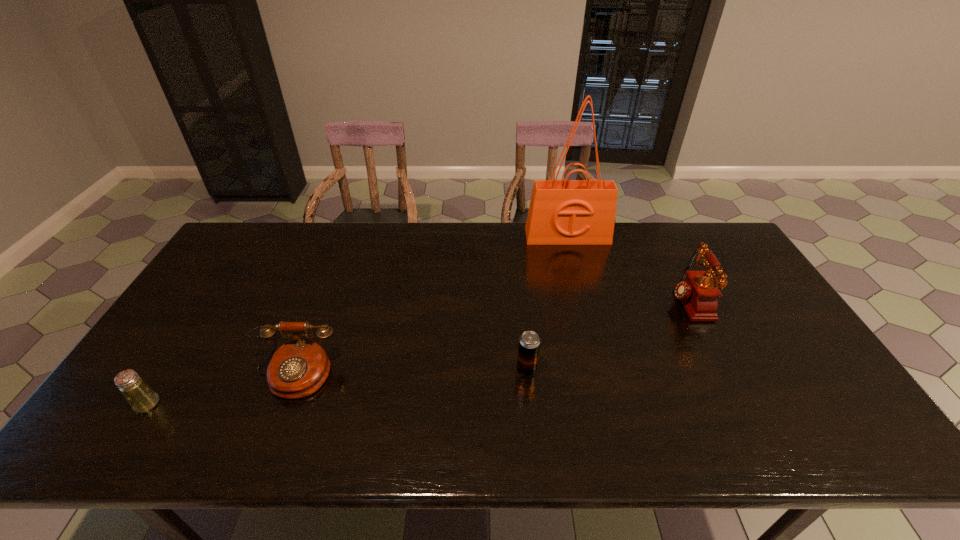
The image size is (960, 540). I want to click on vacant area that lies between the beer can and the shorter telephone, so click(410, 372).

This screenshot has width=960, height=540. I want to click on empty location between the third object from right to left and the tote bag, so click(x=547, y=303).

You are a GUI agent. You are given a task and a screenshot of the screen. Output one action in this format:
    pyautogui.click(x=<x>, y=<y>)
    Task: Click on the empty location between the farthest object and the left telephone
    This screenshot has height=540, width=960.
    Given the screenshot: What is the action you would take?
    pyautogui.click(x=430, y=306)

Find the location of `free spot between the leftmost object and the fourth shortest object`. free spot between the leftmost object and the fourth shortest object is located at coordinates (417, 352).

At what (x,y) coordinates should I click in order to perform the action: click on free space between the third object from right to left and the saltshaker. Please return your answer as a coordinate pair (x, y). This screenshot has height=540, width=960. Looking at the image, I should click on (337, 387).

What are the coordinates of `vacant area that lies between the tallest object and the nearer telephone` in the screenshot? It's located at (430, 306).

Locate an element on the screen. vacant area that lies between the shorter telephone and the leftmost object is located at coordinates (220, 389).

This screenshot has width=960, height=540. I want to click on vacant region between the fourth nearest object and the tote bag, so click(x=627, y=268).

Find the location of a particular element. The height and width of the screenshot is (540, 960). free space between the shorter telephone and the second tallest object is located at coordinates (490, 338).

Find the location of a particular element. vacant area that lies between the taller telephone and the fourth object from right to left is located at coordinates (490, 338).